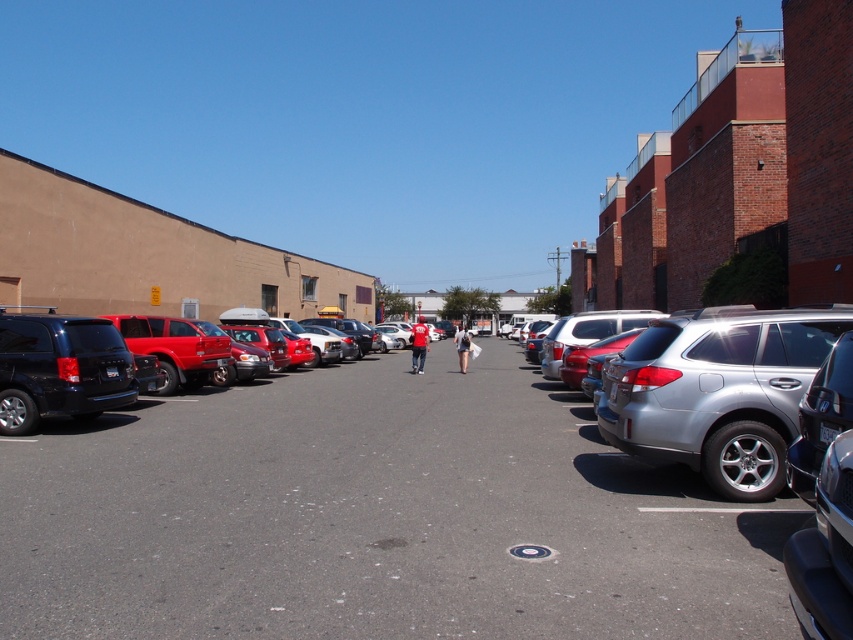
Based on the photo, between shiny black car at center and matte black minivan at left, which one has less height?

shiny black car at center

The width and height of the screenshot is (853, 640). I want to click on shiny black car at center, so click(375, 516).